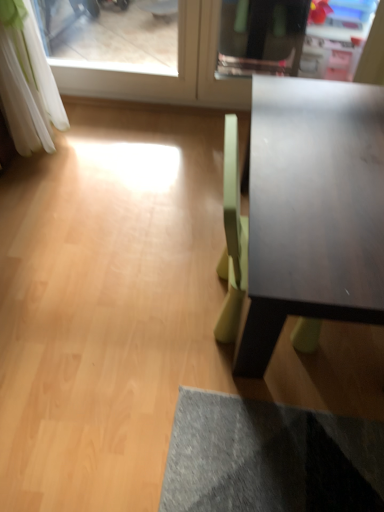
This screenshot has height=512, width=384. I want to click on metallic smooth table at right, so click(x=312, y=210).

The width and height of the screenshot is (384, 512). What do you see at coordinates (312, 210) in the screenshot? I see `metallic smooth table at right` at bounding box center [312, 210].

This screenshot has width=384, height=512. In order to click on metallic smooth table at right in this screenshot , I will do point(312,210).